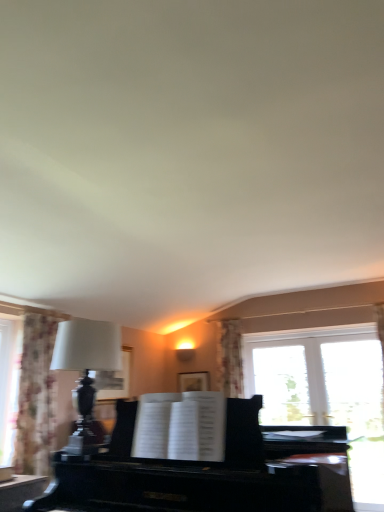
Question: Is matte black lamp at left taller or shorter than floral fabric curtain at left?

Choices:
 (A) short
 (B) tall

Answer: (A)

Question: From the image's perspective, is matte black lamp at left located above or below floral fabric curtain at left?

Choices:
 (A) above
 (B) below

Answer: (A)

Question: Estimate the real-world distances between objects in this image. Which object is farther from the black polished piano at center?

Choices:
 (A) matte black lamp at left
 (B) floral fabric curtain at left

Answer: (B)

Question: Which object is the closest to the black polished piano at center?

Choices:
 (A) matte black lamp at left
 (B) floral fabric curtain at left

Answer: (A)